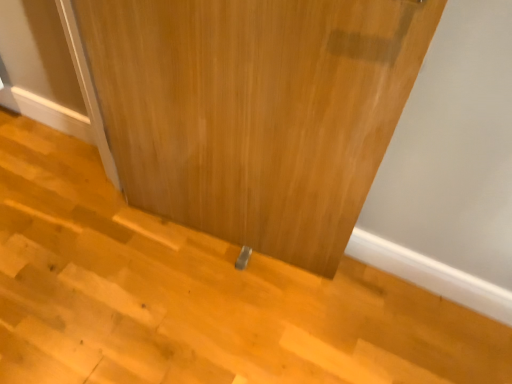
Describe the element at coordinates (196, 296) in the screenshot. I see `wooden at lower center` at that location.

At what (x,y) coordinates should I click in order to perform the action: click on wooden at lower center. Please return your answer as a coordinate pair (x, y). The width and height of the screenshot is (512, 384). Looking at the image, I should click on (196, 296).

What do you see at coordinates (255, 110) in the screenshot?
I see `wooden door at center` at bounding box center [255, 110].

You are a GUI agent. You are given a task and a screenshot of the screen. Output one action in this format:
    pyautogui.click(x=<x>, y=<y>)
    Task: Click on the wooden door at center
    This screenshot has height=384, width=512.
    Given the screenshot: What is the action you would take?
    pyautogui.click(x=255, y=110)

The image size is (512, 384). In order to click on wooden at lower center in this screenshot , I will do `click(196, 296)`.

In the scene shown: Is wooden door at center to the right of wooden at lower center from the viewer's perspective?

In fact, wooden door at center is to the left of wooden at lower center.

In the image, is wooden door at center positioned in front of or behind wooden at lower center?

wooden door at center is positioned closer to the viewer than wooden at lower center.

Which point is more forward, (251,3) or (222,301)?

The point (251,3) is more forward.

From the image's perspective, is wooden door at center on wooden at lower center?

Yes, from the image's perspective, wooden door at center is on top of wooden at lower center.

From a real-world perspective, which object stands above the other?

wooden door at center.

Which of these two, wooden door at center or wooden at lower center, is thinner?

Thinner between the two is wooden door at center.

Who is shorter, wooden door at center or wooden at lower center?

wooden at lower center.

Consider the image. Is wooden door at center bigger or smaller than wooden at lower center?

Considering their sizes, wooden door at center takes up more space than wooden at lower center.

Do you think wooden door at center is within wooden at lower center, or outside of it?

wooden door at center cannot be found inside wooden at lower center.

Based on the photo, are wooden door at center and wooden at lower center making contact?

No, wooden door at center is not touching wooden at lower center.

Is wooden door at center positioned with its back to wooden at lower center?

wooden door at center is not turned away from wooden at lower center.

In the scene shown: What's the angular difference between wooden door at center and wooden at lower center's facing directions?

They differ by 173 degrees in their facing directions.

This screenshot has height=384, width=512. In order to click on stair that appears below the wooden door at center (from a real-world perspective) in this screenshot , I will do `click(196, 296)`.

Considering the positions of objects wooden at lower center and wooden door at center in the image provided, who is more to the left, wooden at lower center or wooden door at center?

wooden door at center.

Is the depth of wooden at lower center less than that of wooden door at center?

That is False.

Considering the positions of point (38, 151) and point (203, 138), is point (38, 151) closer or farther from the camera than point (203, 138)?

Point (38, 151) appears to be farther away from the viewer than point (203, 138).

From the image's perspective, is wooden at lower center above wooden door at center?

No.

Based on the photo, from a real-world perspective, is wooden at lower center over wooden door at center?

No, from a real-world perspective, wooden at lower center is not over wooden door at center

Which object is wider, wooden at lower center or wooden door at center?

wooden at lower center is wider.

Between wooden at lower center and wooden door at center, which one has more height?

Standing taller between the two is wooden door at center.

Is wooden at lower center smaller than wooden door at center?

Indeed, wooden at lower center has a smaller size compared to wooden door at center.

Is wooden at lower center inside the boundaries of wooden door at center, or outside?

The correct answer is: outside.

Is wooden at lower center touching wooden door at center?

No, wooden at lower center is not making contact with wooden door at center.

In the scene shown: Is wooden at lower center aimed at wooden door at center?

No, wooden at lower center is not oriented towards wooden door at center.

Find the location of a particular element. Image resolution: width=512 pixels, height=384 pixels. door above the wooden at lower center (from a real-world perspective) is located at coordinates (255, 110).

The height and width of the screenshot is (384, 512). In order to click on stair behind the wooden door at center in this screenshot , I will do `click(196, 296)`.

At what (x,y) coordinates should I click in order to perform the action: click on stair to the right of wooden door at center. Please return your answer as a coordinate pair (x, y). The height and width of the screenshot is (384, 512). Looking at the image, I should click on (196, 296).